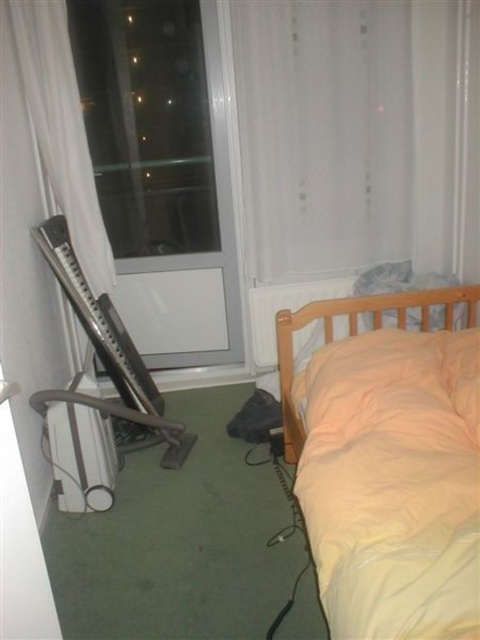
Can you confirm if white sheer curtain at left is positioned to the right of light orange fabric bed at right?

Incorrect, white sheer curtain at left is not on the right side of light orange fabric bed at right.

Is white sheer curtain at left closer to camera compared to light orange fabric bed at right?

No, it is not.

Which is in front, point (64, 77) or point (324, 317)?

Point (324, 317)

Where is `white sheer curtain at left`? The height and width of the screenshot is (640, 480). white sheer curtain at left is located at coordinates (61, 129).

This screenshot has height=640, width=480. Describe the element at coordinates (159, 148) in the screenshot. I see `transparent plastic screen door at left` at that location.

Is transparent plastic screen door at left to the left of white sheer curtain at left from the viewer's perspective?

No, transparent plastic screen door at left is not to the left of white sheer curtain at left.

The height and width of the screenshot is (640, 480). What are the coordinates of `transparent plastic screen door at left` in the screenshot? It's located at (159, 148).

Image resolution: width=480 pixels, height=640 pixels. Find the location of `transparent plastic screen door at left`. transparent plastic screen door at left is located at coordinates (159, 148).

Which is behind, point (101, 154) or point (286, 333)?

The point (101, 154) is more distant.

Is transparent plastic screen door at left smaller than light orange fabric bed at right?

No, transparent plastic screen door at left is not smaller than light orange fabric bed at right.

Measure the distance between point (201, 100) and camera.

The distance of point (201, 100) from camera is 2.95 meters.

Where is `transparent plastic screen door at left`? transparent plastic screen door at left is located at coordinates (159, 148).